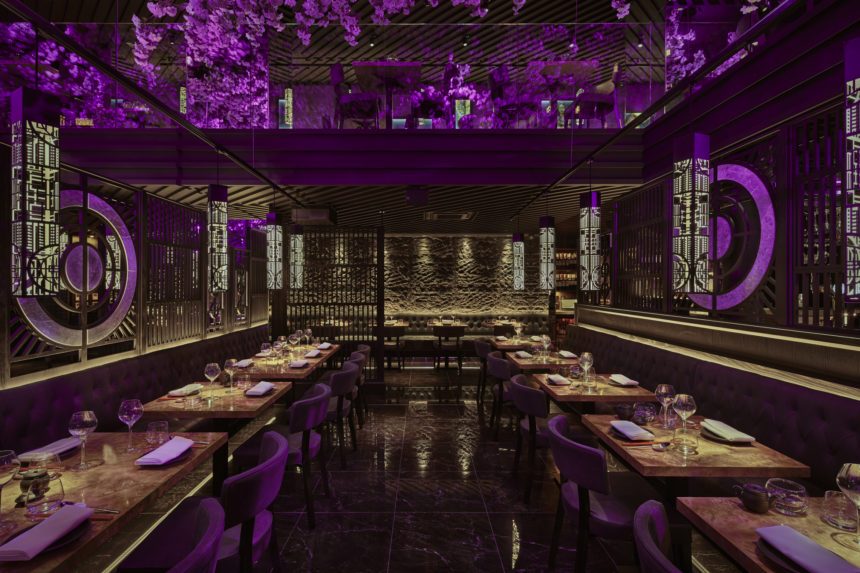
Locate an element on the screen. This screenshot has height=573, width=860. rightmost chair is located at coordinates (648, 537).